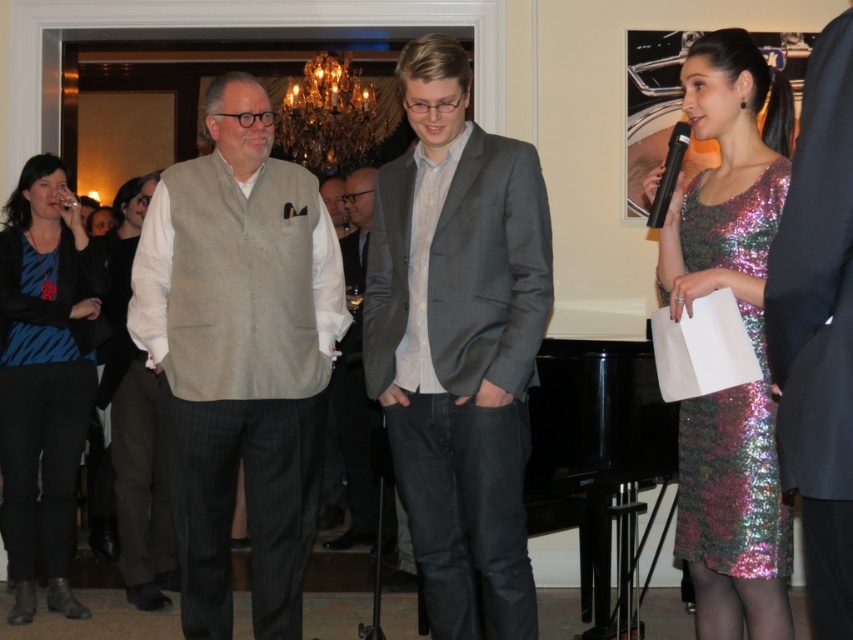
Where is `black wool suit at right`? black wool suit at right is located at coordinates (817, 330).

Is black wool suit at right thinner than holographic sequin dress at right?

Yes, black wool suit at right is thinner than holographic sequin dress at right.

Does point (788, 269) come behind point (709, 442)?

That is False.

Find the location of a particular element. black wool suit at right is located at coordinates (817, 330).

What do you see at coordinates (733, 476) in the screenshot?
I see `holographic sequin dress at right` at bounding box center [733, 476].

Is point (714, 476) in front of point (329, 204)?

Yes, it is in front of point (329, 204).

Identify the location of holographic sequin dress at right. The height and width of the screenshot is (640, 853). (733, 476).

Is point (44, 513) farther from viewer compared to point (332, 192)?

No, (44, 513) is in front of (332, 192).

Which is more to the right, zebra print sweater at left or light brown textured blazer at center?

Positioned to the right is light brown textured blazer at center.

Who is more distant from viewer, (68, 490) or (323, 186)?

Positioned behind is point (323, 186).

In order to click on zebra print sweater at left in this screenshot , I will do point(44,378).